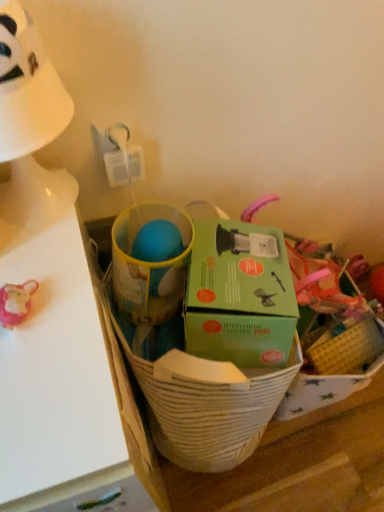
What do you see at coordinates (55, 370) in the screenshot?
I see `white matte table at left` at bounding box center [55, 370].

I want to click on green cardboard box at center, so click(x=239, y=295).

Image resolution: width=384 pixels, height=512 pixels. In order to click on white matte table at left in this screenshot , I will do `click(55, 370)`.

At what (x,y) coordinates should I click in order to perform the action: click on table that is in front of the green cardboard box at center. Please return your answer as a coordinate pair (x, y). The width and height of the screenshot is (384, 512). Looking at the image, I should click on (55, 370).

Are white matte table at left and green cardboard box at center located far from each other?

No, white matte table at left is not far from green cardboard box at center.

From a real-world perspective, which is physically below, white matte table at left or green cardboard box at center?

In real-world perspective, white matte table at left is lower.

Is white matte table at left smaller than green cardboard box at center?

Actually, white matte table at left might be larger than green cardboard box at center.

In terms of size, does white plastic table lamp at upper left appear bigger or smaller than green cardboard box at center?

white plastic table lamp at upper left is smaller than green cardboard box at center.

Is white plastic table lamp at upper left far away from green cardboard box at center?

No, white plastic table lamp at upper left is not far away from green cardboard box at center.

Can you tell me how much white plastic table lamp at upper left and green cardboard box at center differ in facing direction?

The angular difference between white plastic table lamp at upper left and green cardboard box at center is 23.1 degrees.

Between point (41, 199) and point (233, 323), which one is positioned behind?

The point (233, 323) is farther.

Looking at this image, is green cardboard box at center aimed at white matte table at left?

No, green cardboard box at center is not facing towards white matte table at left.

From a real-world perspective, between green cardboard box at center and white matte table at left, who is vertically higher?

In real-world perspective, green cardboard box at center is above.

Can you confirm if green cardboard box at center is taller than white matte table at left?

No.

Does green cardboard box at center come behind white matte table at left?

That is True.

Is white matte table at left taller or shorter than white plastic table lamp at upper left?

Clearly, white matte table at left is taller compared to white plastic table lamp at upper left.

Between white matte table at left and white plastic table lamp at upper left, which one has larger width?

white matte table at left is wider.

Would you consider white matte table at left to be distant from white plastic table lamp at upper left?

No, white matte table at left is in close proximity to white plastic table lamp at upper left.

Where is `table lamp that appears above the white matte table at left (from a real-world perspective)`? This screenshot has width=384, height=512. table lamp that appears above the white matte table at left (from a real-world perspective) is located at coordinates (29, 130).

From a real-world perspective, which is physically below, green cardboard box at center or green cardboard box at center?

green cardboard box at center, from a real-world perspective.

Can green cardboard box at center be found inside green cardboard box at center?

No, green cardboard box at center is not inside green cardboard box at center.

Is green cardboard box at center taller or shorter than green cardboard box at center?

Considering their sizes, green cardboard box at center has less height than green cardboard box at center.

From the image's perspective, is green cardboard box at center located beneath green cardboard box at center?

Actually, green cardboard box at center appears above green cardboard box at center in the image.

The height and width of the screenshot is (512, 384). Find the location of `table below the white plastic table lamp at upper left (from a real-world perspective)`. table below the white plastic table lamp at upper left (from a real-world perspective) is located at coordinates (55, 370).

Is white plastic table lamp at upper left looking in the opposite direction of white matte table at left?

white plastic table lamp at upper left is not turned away from white matte table at left.

What's the angular difference between white plastic table lamp at upper left and white matte table at left's facing directions?

2.55 degrees separate the facing orientations of white plastic table lamp at upper left and white matte table at left.

Based on the photo, considering the positions of objects white plastic table lamp at upper left and white matte table at left in the image provided, who is more to the right, white plastic table lamp at upper left or white matte table at left?

From the viewer's perspective, white plastic table lamp at upper left appears more on the right side.

Consider the image. Can you confirm if green cardboard box at center is wider than white plastic table lamp at upper left?

Indeed, green cardboard box at center has a greater width compared to white plastic table lamp at upper left.

Choose the correct answer: Is green cardboard box at center inside white plastic table lamp at upper left or outside it?

green cardboard box at center cannot be found inside white plastic table lamp at upper left.

Is green cardboard box at center looking in the opposite direction of white plastic table lamp at upper left?

No, green cardboard box at center is not facing away from white plastic table lamp at upper left.

In the scene shown: From a real-world perspective, is green cardboard box at center positioned over white plastic table lamp at upper left based on gravity?

No, from a real-world perspective, green cardboard box at center is not above white plastic table lamp at upper left.

Find the location of a particular element. box that appears on the right of white matte table at left is located at coordinates (239, 295).

In order to click on box behind the white plastic table lamp at upper left in this screenshot , I will do `click(239, 295)`.

Which object lies nearer to the anchor point white plastic table lamp at upper left, green cardboard box at center or white matte table at left?

The object closer to white plastic table lamp at upper left is white matte table at left.

Based on the photo, which object lies further to the anchor point green cardboard box at center, white plastic table lamp at upper left or green cardboard box at center?

Based on the image, white plastic table lamp at upper left appears to be further to green cardboard box at center.

Based on their spatial positions, is green cardboard box at center or white matte table at left closer to green cardboard box at center?

white matte table at left is closer to green cardboard box at center.

Estimate the real-world distances between objects in this image. Which object is further from white matte table at left, green cardboard box at center or green cardboard box at center?

green cardboard box at center lies further to white matte table at left than the other object.

Considering their positions, is green cardboard box at center positioned closer to white matte table at left than green cardboard box at center?

Among the two, green cardboard box at center is located nearer to white matte table at left.

Based on their spatial positions, is green cardboard box at center or white plastic table lamp at upper left further from green cardboard box at center?

white plastic table lamp at upper left.

Which object lies further to the anchor point white matte table at left, white plastic table lamp at upper left or green cardboard box at center?

green cardboard box at center lies further to white matte table at left than the other object.

Considering their positions, is white matte table at left positioned further to green cardboard box at center than green cardboard box at center?

Based on the image, green cardboard box at center appears to be further to green cardboard box at center.

Identify the location of box between white plastic table lamp at upper left and white matte table at left in the up-down direction. (239, 295).

At what (x,y) coordinates should I click in order to perform the action: click on cardboard box between white plastic table lamp at upper left and white matte table at left vertically. Please return your answer as a coordinate pair (x, y). Looking at the image, I should click on click(x=259, y=445).

This screenshot has height=512, width=384. I want to click on box between white plastic table lamp at upper left and green cardboard box at center vertically, so click(x=239, y=295).

This screenshot has width=384, height=512. I want to click on cardboard box between white matte table at left and green cardboard box at center, so click(259, 445).